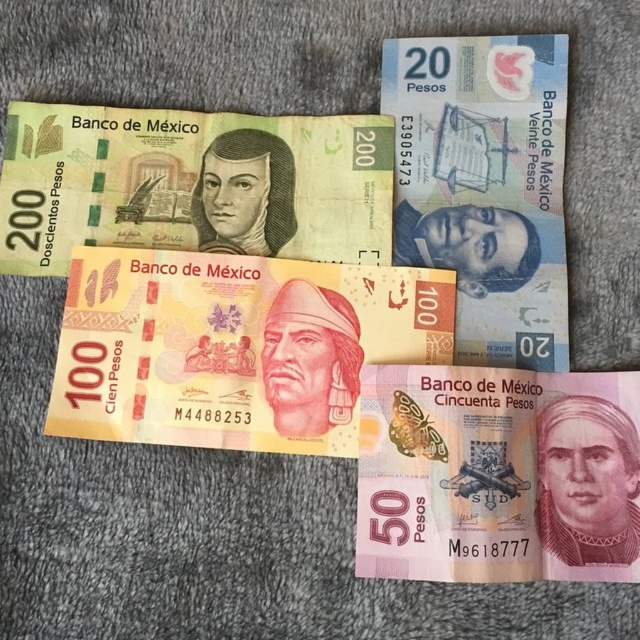
Can you confirm if yellow paper currency at center is positioned to the left of green paper currency at upper left?

No, yellow paper currency at center is not to the left of green paper currency at upper left.

The image size is (640, 640). What do you see at coordinates (236, 346) in the screenshot? I see `yellow paper currency at center` at bounding box center [236, 346].

Locate an element on the screen. yellow paper currency at center is located at coordinates (236, 346).

Does pink paper money at center have a lesser width compared to blue paper currency at upper right?

Incorrect, pink paper money at center's width is not less than blue paper currency at upper right's.

Who is lower down, pink paper money at center or blue paper currency at upper right?

pink paper money at center is lower down.

Which is in front, point (490, 547) or point (509, 346)?

Point (490, 547) is more forward.

This screenshot has height=640, width=640. Find the location of `pink paper money at center`. pink paper money at center is located at coordinates (497, 474).

Which is more to the right, pink paper money at center or green paper currency at upper left?

From the viewer's perspective, pink paper money at center appears more on the right side.

Which is above, pink paper money at center or green paper currency at upper left?

green paper currency at upper left is higher up.

Which is behind, point (625, 557) or point (58, 108)?

Positioned behind is point (58, 108).

At what (x,y) coordinates should I click in order to perform the action: click on pink paper money at center. Please return your answer as a coordinate pair (x, y). The image size is (640, 640). Looking at the image, I should click on (497, 474).